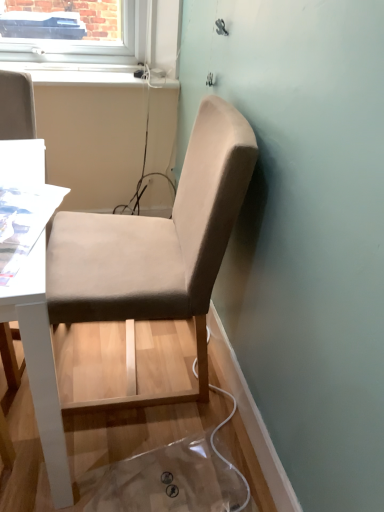
What do you see at coordinates (157, 246) in the screenshot? The image size is (384, 512). I see `beige fabric chair at center` at bounding box center [157, 246].

Identify the location of beige fabric chair at center. This screenshot has height=512, width=384. click(x=157, y=246).

The height and width of the screenshot is (512, 384). What do you see at coordinates (76, 73) in the screenshot? I see `white plastic window sill at upper center` at bounding box center [76, 73].

I want to click on white plastic window sill at upper center, so click(x=76, y=73).

Where is `beige fabric chair at center`? The height and width of the screenshot is (512, 384). beige fabric chair at center is located at coordinates (157, 246).

Considering the relative positions of white plastic window sill at upper center and beige fabric chair at center in the image provided, is white plastic window sill at upper center to the right of beige fabric chair at center from the viewer's perspective?

No, white plastic window sill at upper center is not to the right of beige fabric chair at center.

Which object is closer to the camera, white plastic window sill at upper center or beige fabric chair at center?

Positioned in front is beige fabric chair at center.

Is point (104, 69) closer to viewer compared to point (219, 134)?

That is False.

From the image's perspective, which object appears higher, white plastic window sill at upper center or beige fabric chair at center?

white plastic window sill at upper center appears higher in the image.

From a real-world perspective, between white plastic window sill at upper center and beige fabric chair at center, who is vertically higher?

white plastic window sill at upper center is physically above.

Which object is thinner, white plastic window sill at upper center or beige fabric chair at center?

With smaller width is white plastic window sill at upper center.

Looking at this image, who is taller, white plastic window sill at upper center or beige fabric chair at center?

beige fabric chair at center.

Which of these two, white plastic window sill at upper center or beige fabric chair at center, is bigger?

beige fabric chair at center is bigger.

Is beige fabric chair at center surrounded by white plastic window sill at upper center?

No.

Would you consider white plastic window sill at upper center to be distant from beige fabric chair at center?

No, white plastic window sill at upper center is in close proximity to beige fabric chair at center.

Is white plastic window sill at upper center aimed at beige fabric chair at center?

Yes, white plastic window sill at upper center is aimed at beige fabric chair at center.

Identify the location of window sill that appears above the beige fabric chair at center (from the image's perspective). The height and width of the screenshot is (512, 384). (76, 73).

In the scene shown: Which is more to the right, beige fabric chair at center or white plastic window sill at upper center?

beige fabric chair at center is more to the right.

Is the position of beige fabric chair at center more distant than that of white plastic window sill at upper center?

No, it is not.

Does point (153, 232) appear closer or farther from the camera than point (115, 83)?

Clearly, point (153, 232) is closer to the camera than point (115, 83).

From the image's perspective, which is above, beige fabric chair at center or white plastic window sill at upper center?

white plastic window sill at upper center appears higher in the image.

From a real-world perspective, is beige fabric chair at center physically above white plastic window sill at upper center?

No, from a real-world perspective, beige fabric chair at center is not above white plastic window sill at upper center.

Does beige fabric chair at center have a greater width compared to white plastic window sill at upper center?

Indeed, beige fabric chair at center has a greater width compared to white plastic window sill at upper center.

Considering the sizes of objects beige fabric chair at center and white plastic window sill at upper center in the image provided, who is taller, beige fabric chair at center or white plastic window sill at upper center?

With more height is beige fabric chair at center.

From the picture: Does beige fabric chair at center have a larger size compared to white plastic window sill at upper center?

Yes, beige fabric chair at center is bigger than white plastic window sill at upper center.

Is white plastic window sill at upper center located within beige fabric chair at center?

That's incorrect, white plastic window sill at upper center is not inside beige fabric chair at center.

Is beige fabric chair at center placed right next to white plastic window sill at upper center?

No, beige fabric chair at center is not beside white plastic window sill at upper center.

Is beige fabric chair at center positioned with its back to white plastic window sill at upper center?

beige fabric chair at center is not turned away from white plastic window sill at upper center.

How many degrees apart are the facing directions of beige fabric chair at center and white plastic window sill at upper center?

90.8 degrees.

Locate an element on the screen. chair on the right of white plastic window sill at upper center is located at coordinates (157, 246).

Image resolution: width=384 pixels, height=512 pixels. What are the coordinates of `window sill behind the beige fabric chair at center` in the screenshot? It's located at (76, 73).

Find the location of a particular element. window sill above the beige fabric chair at center (from the image's perspective) is located at coordinates (76, 73).